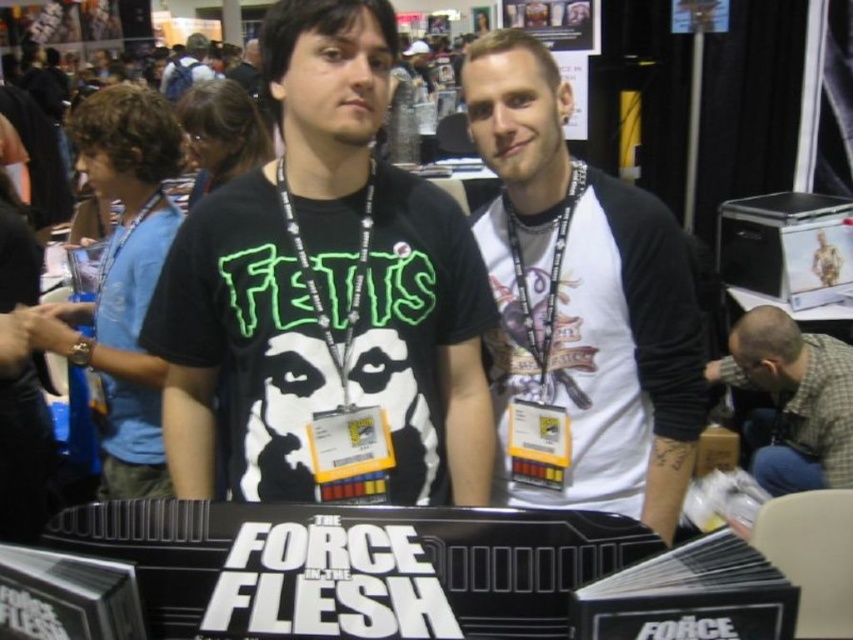
Question: Which point is closer to the camera?

Choices:
 (A) black matte t-shirt at center
 (B) gray plaid shirt at lower right
 (C) white matte t-shirt at center

Answer: (A)

Question: Can you confirm if black matte t-shirt at center is bigger than blue backpack at upper left?

Choices:
 (A) no
 (B) yes

Answer: (A)

Question: Is white matte t-shirt at center below blue backpack at upper left?

Choices:
 (A) no
 (B) yes

Answer: (B)

Question: Does black matte t-shirt at center have a greater width compared to blue backpack at upper left?

Choices:
 (A) no
 (B) yes

Answer: (B)

Question: Which is farther from the black matte t-shirt at center?

Choices:
 (A) blue backpack at upper left
 (B) white matte t-shirt at center

Answer: (A)

Question: Which point is closer to the camera?

Choices:
 (A) (173, 67)
 (B) (801, 397)
 (C) (608, 321)

Answer: (C)